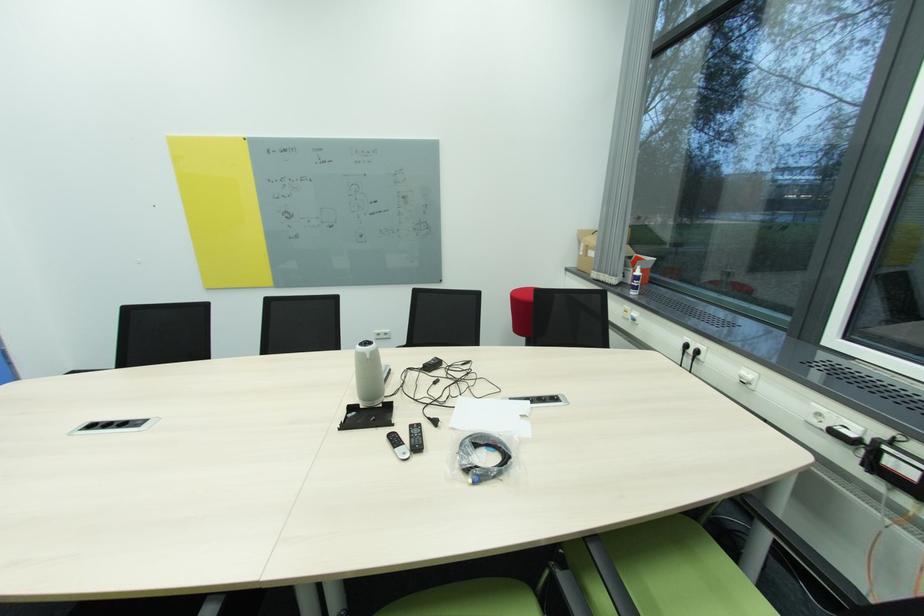
Find where to lift the cardboard box. Please return your answer as a coordinate pair (x, y).

(590, 249)